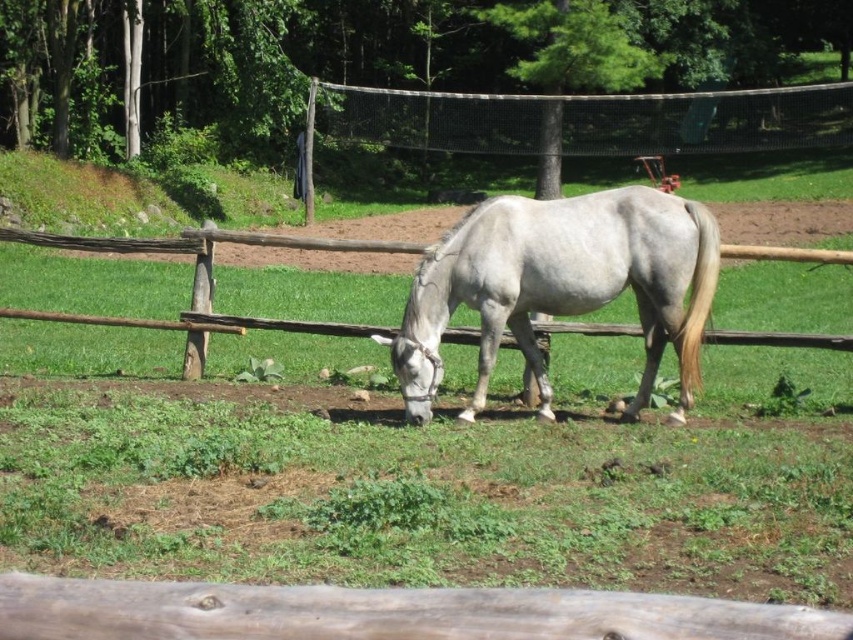
You are a photographer standing at the point marked by the coordinate point (561, 284). What object is located exactly at that coordinate in the image?

The point (561, 284) marks the white matte horse at center.

You are a farmer checking the pasture for potential hazards. You notice the white matte horse at center and the black mesh fence at upper center. Which object is narrower in width?

The white matte horse at center is thinner than the black mesh fence at upper center, so the white matte horse at center is narrower in width.